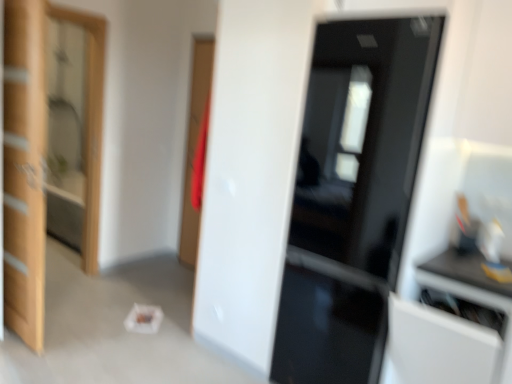
Question: Relative to wooden door at left, which is the 2th door from right to left, is clear glass screen door at left in front or behind?

Choices:
 (A) behind
 (B) front

Answer: (A)

Question: Considering the positions of clear glass screen door at left and wooden door at left, which is the 2th door from right to left, in the image, is clear glass screen door at left wider or thinner than wooden door at left, which is the 2th door from right to left,?

Choices:
 (A) thin
 (B) wide

Answer: (B)

Question: Considering the real-world distances, which object is closest to the clear glass screen door at left?

Choices:
 (A) glossy black door at center, which is the first door from right to left
 (B) wooden door at left, which is the 2th door from right to left
 (C) white glossy cabinet at right

Answer: (B)

Question: Which object is positioned closest to the clear glass screen door at left?

Choices:
 (A) white glossy cabinet at right
 (B) wooden door at left, which is the 2th door from right to left
 (C) glossy black door at center, which is counted as the second door, starting from the left

Answer: (B)